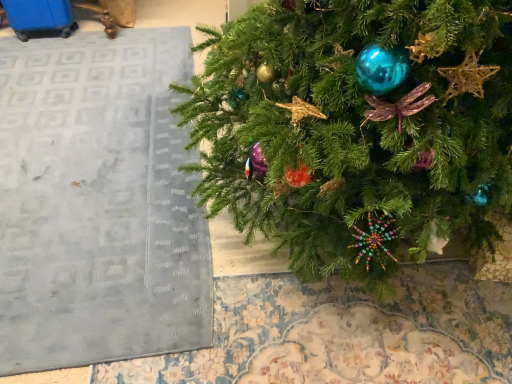
Question: From the image's perspective, is green matte christmas tree at center over matte gray rug at lower left?

Choices:
 (A) yes
 (B) no

Answer: (A)

Question: Are green matte christmas tree at center and matte gray rug at lower left far apart?

Choices:
 (A) no
 (B) yes

Answer: (A)

Question: Does green matte christmas tree at center have a lesser width compared to matte gray rug at lower left?

Choices:
 (A) yes
 (B) no

Answer: (A)

Question: Can you confirm if green matte christmas tree at center is shorter than matte gray rug at lower left?

Choices:
 (A) yes
 (B) no

Answer: (B)

Question: Does green matte christmas tree at center have a greater width compared to matte gray rug at lower left?

Choices:
 (A) yes
 (B) no

Answer: (B)

Question: Is green matte christmas tree at center facing away from matte gray rug at lower left?

Choices:
 (A) yes
 (B) no

Answer: (B)

Question: Can you confirm if matte gray rug at lower left is smaller than green matte christmas tree at center?

Choices:
 (A) no
 (B) yes

Answer: (B)

Question: Is matte gray rug at lower left located outside green matte christmas tree at center?

Choices:
 (A) yes
 (B) no

Answer: (A)

Question: Is matte gray rug at lower left facing towards green matte christmas tree at center?

Choices:
 (A) no
 (B) yes

Answer: (A)

Question: From the image's perspective, does matte gray rug at lower left appear lower than green matte christmas tree at center?

Choices:
 (A) yes
 (B) no

Answer: (A)

Question: Does matte gray rug at lower left appear on the right side of green matte christmas tree at center?

Choices:
 (A) no
 (B) yes

Answer: (A)

Question: Does matte gray rug at lower left have a larger size compared to green matte christmas tree at center?

Choices:
 (A) yes
 (B) no

Answer: (B)

Question: Looking at their shapes, would you say matte gray rug at lower left is wider or thinner than green matte christmas tree at center?

Choices:
 (A) thin
 (B) wide

Answer: (B)